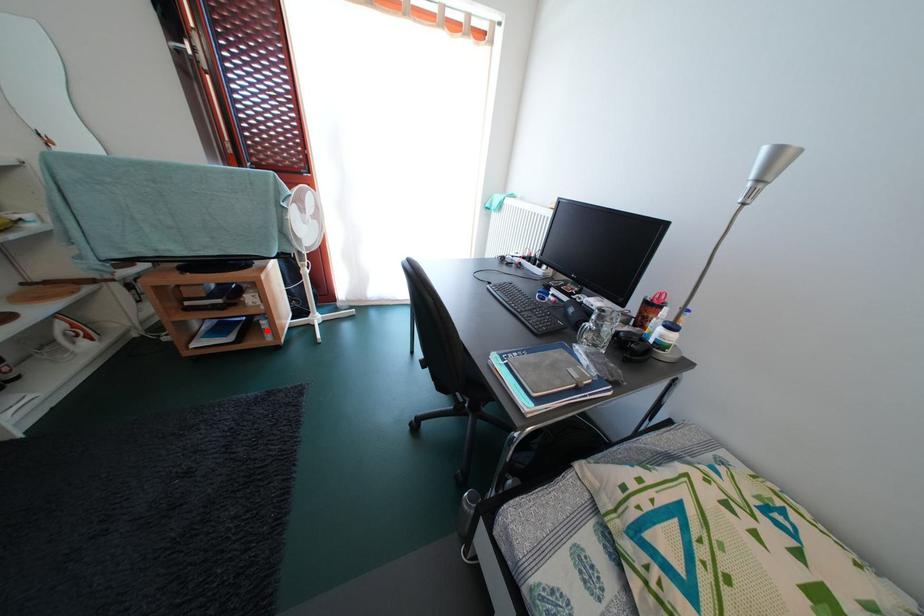
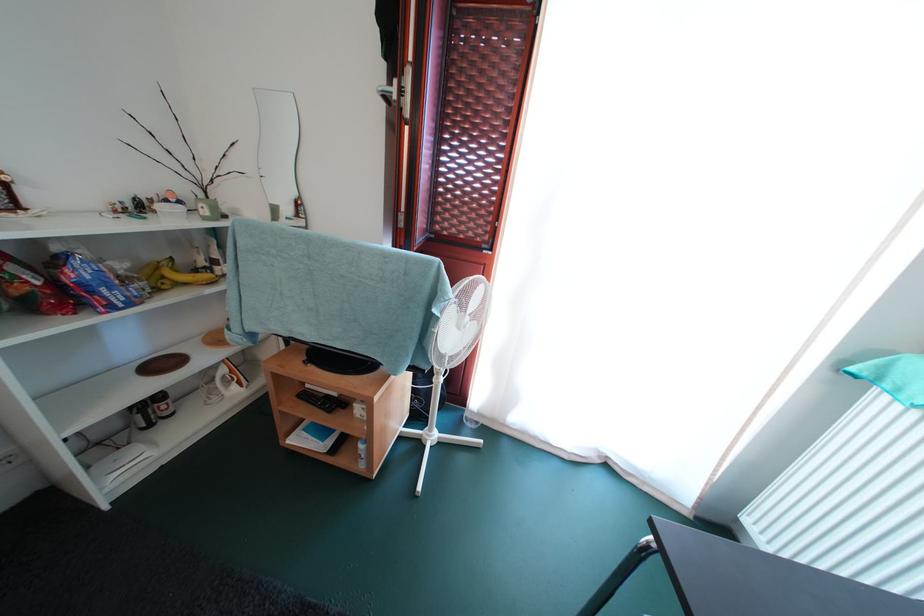
In the second image, find the point that corresponds to the highlighted location in the first image.

(363, 453)